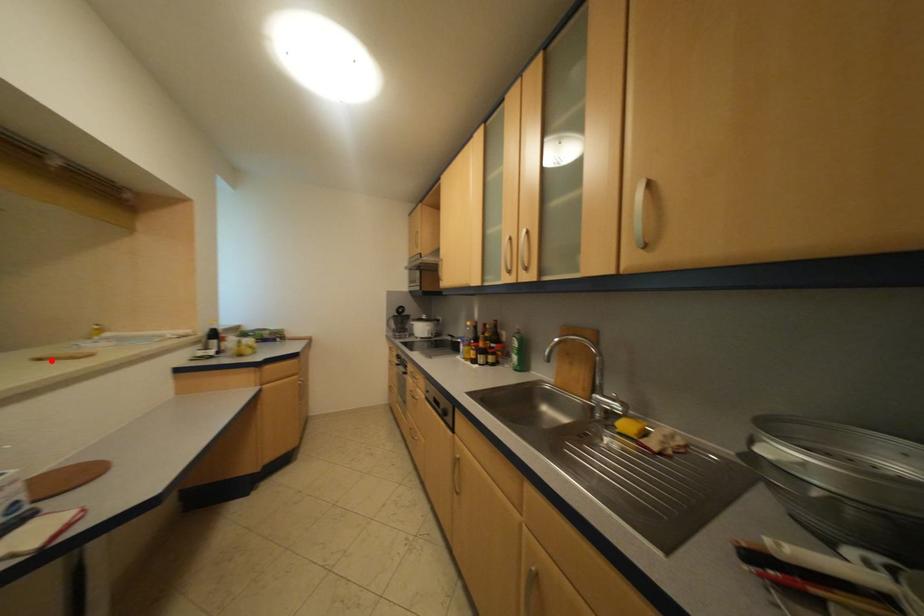
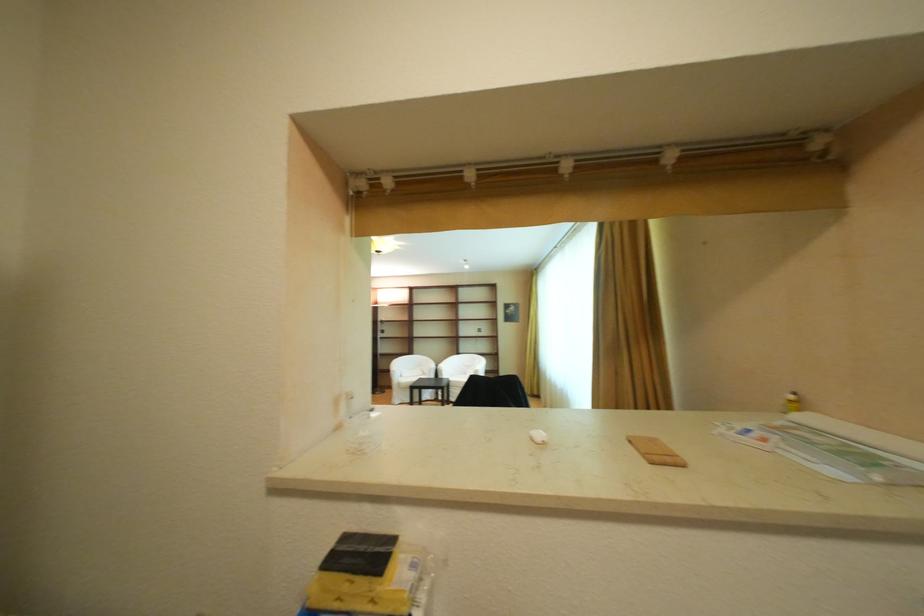
In the second image, find the point that corresponds to the highlighted location in the first image.

(642, 444)